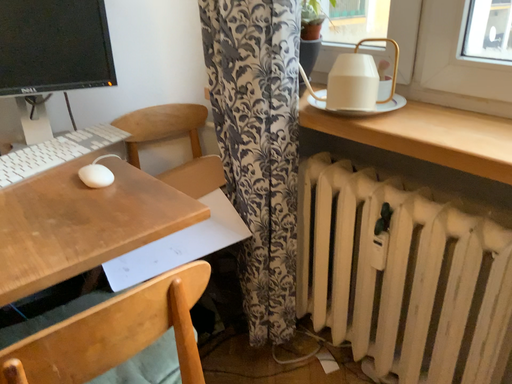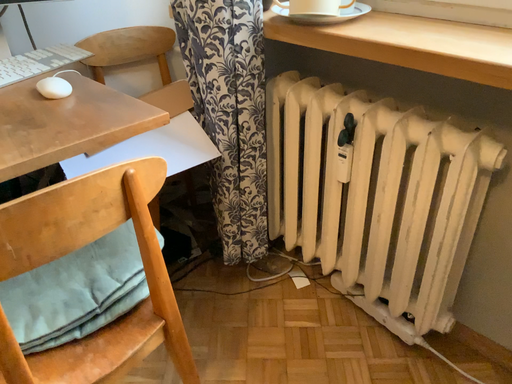
Question: Which way did the camera rotate in the video?

Choices:
 (A) rotated downward
 (B) rotated upward

Answer: (A)